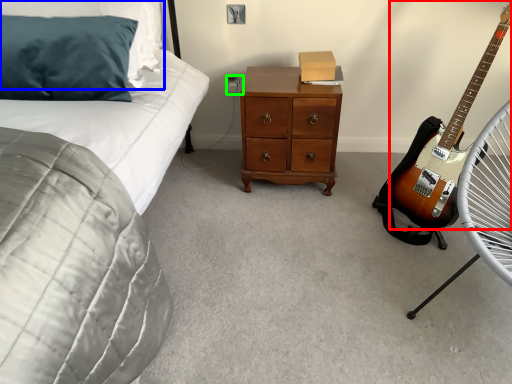
Question: Considering the real-world distances, which object is closest to guitar (highlighted by a red box)? pillow (highlighted by a blue box) or electric outlet (highlighted by a green box).

Choices:
 (A) pillow
 (B) electric outlet

Answer: (B)